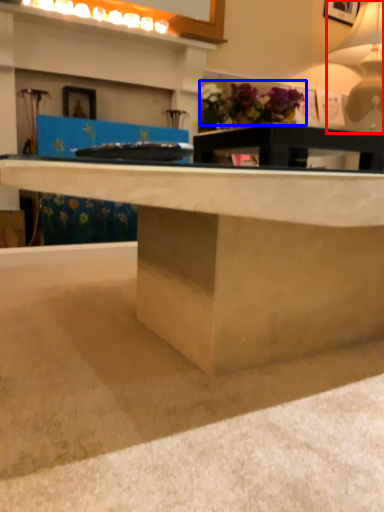
Question: Which point is closer to the camera, table lamp (highlighted by a red box) or flower (highlighted by a blue box)?

Choices:
 (A) table lamp
 (B) flower

Answer: (A)